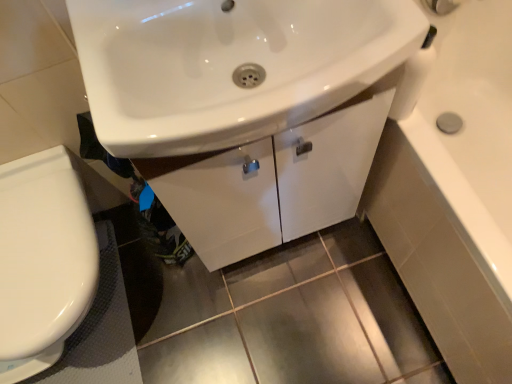
In order to click on white glossy toilet at lower left in this screenshot , I will do `click(42, 261)`.

What do you see at coordinates (101, 333) in the screenshot? I see `black rubber bath mat at lower left` at bounding box center [101, 333].

In order to face white glossy faucet at upper center, should I rotate leftwards or rightwards?

It's best to rotate left around 4.701 degrees.

Where is `white glossy faucet at upper center`? Image resolution: width=512 pixels, height=384 pixels. white glossy faucet at upper center is located at coordinates (261, 21).

Where is `white glossy cabinet at center`? The image size is (512, 384). white glossy cabinet at center is located at coordinates (274, 181).

Considering the sizes of objects white glossy toilet at lower left and white glossy sink at center in the image provided, who is thinner, white glossy toilet at lower left or white glossy sink at center?

white glossy sink at center.

Is white glossy toilet at lower left looking in the opposite direction of white glossy sink at center?

white glossy toilet at lower left is not turned away from white glossy sink at center.

Is white glossy toilet at lower left surrounding white glossy sink at center?

No, white glossy sink at center is not inside white glossy toilet at lower left.

Which is behind, point (58, 335) or point (133, 43)?

The point (58, 335) is more distant.

Looking at the image, does black rubber bath mat at lower left seem bigger or smaller compared to white glossy cabinet at center?

Clearly, black rubber bath mat at lower left is smaller in size than white glossy cabinet at center.

Where is `bath mat lying below the white glossy cabinet at center (from the image's perspective)`? bath mat lying below the white glossy cabinet at center (from the image's perspective) is located at coordinates (101, 333).

Can you tell me how much black rubber bath mat at lower left and white glossy cabinet at center differ in facing direction?

black rubber bath mat at lower left and white glossy cabinet at center are facing 88.2 degrees away from each other.

From the image's perspective, which one is positioned higher, black rubber bath mat at lower left or white glossy cabinet at center?

From the image's view, white glossy cabinet at center is above.

Are white glossy sink at center and white glossy toilet at lower left beside each other?

white glossy sink at center and white glossy toilet at lower left are not in contact.

Considering the points (312, 58) and (66, 278), which point is behind, point (312, 58) or point (66, 278)?

Positioned behind is point (66, 278).

Is white glossy sink at center bigger than white glossy toilet at lower left?

No.

In the scene shown: Which object is positioned more to the right, white glossy sink at center or white glossy toilet at lower left?

white glossy sink at center.

The width and height of the screenshot is (512, 384). In order to click on toilet located above the black rubber bath mat at lower left (from a real-world perspective) in this screenshot , I will do `click(42, 261)`.

How much distance is there between black rubber bath mat at lower left and white glossy toilet at lower left?

They are 30.96 centimeters apart.

Consider the image. Is black rubber bath mat at lower left positioned with its back to white glossy toilet at lower left?

No, black rubber bath mat at lower left is not facing the opposite direction of white glossy toilet at lower left.

Is the position of black rubber bath mat at lower left less distant than that of white glossy toilet at lower left?

No, black rubber bath mat at lower left is further to the viewer.

Is white glossy toilet at lower left oriented towards white glossy faucet at upper center?

No, white glossy toilet at lower left does not turn towards white glossy faucet at upper center.

Consider the image. Measure the distance from white glossy toilet at lower left to white glossy faucet at upper center.

white glossy toilet at lower left and white glossy faucet at upper center are 27.66 inches apart.

From a real-world perspective, is white glossy toilet at lower left over white glossy faucet at upper center?

Incorrect, from a real-world perspective, white glossy toilet at lower left is lower than white glossy faucet at upper center.

Looking at their sizes, would you say white glossy toilet at lower left is wider or thinner than white glossy faucet at upper center?

white glossy toilet at lower left is wider than white glossy faucet at upper center.

From a real-world perspective, relative to black rubber bath mat at lower left, is white glossy toilet at lower left vertically above or below?

white glossy toilet at lower left is above black rubber bath mat at lower left.

Can you confirm if white glossy toilet at lower left is taller than black rubber bath mat at lower left?

Yes.

Consider the image. Are white glossy toilet at lower left and black rubber bath mat at lower left making contact?

No, white glossy toilet at lower left is not next to black rubber bath mat at lower left.

From a real-world perspective, who is located higher, white glossy cabinet at center or white glossy sink at center?

white glossy sink at center.

How different are the orientations of white glossy cabinet at center and white glossy sink at center in degrees?

white glossy cabinet at center and white glossy sink at center are facing 0.255 degrees away from each other.

Is white glossy cabinet at center looking in the opposite direction of white glossy sink at center?

No, white glossy sink at center is not at the back of white glossy cabinet at center.

Identify the location of toilet that is behind the white glossy sink at center. (42, 261).

Where is `bathroom cabinet above the black rubber bath mat at lower left (from a real-world perspective)`? This screenshot has height=384, width=512. bathroom cabinet above the black rubber bath mat at lower left (from a real-world perspective) is located at coordinates (274, 181).

Estimate the real-world distances between objects in this image. Which object is closer to white glossy toilet at lower left, white glossy cabinet at center or black rubber bath mat at lower left?

The object closer to white glossy toilet at lower left is black rubber bath mat at lower left.

Considering their positions, is white glossy cabinet at center positioned closer to black rubber bath mat at lower left than white glossy faucet at upper center?

white glossy cabinet at center lies closer to black rubber bath mat at lower left than the other object.

Looking at the image, which one is located closer to white glossy faucet at upper center, black rubber bath mat at lower left or white glossy cabinet at center?

white glossy cabinet at center is positioned closer to the anchor white glossy faucet at upper center.

Estimate the real-world distances between objects in this image. Which object is further from white glossy cabinet at center, white glossy sink at center or white glossy faucet at upper center?

The object further to white glossy cabinet at center is white glossy faucet at upper center.

Looking at the image, which one is located closer to white glossy faucet at upper center, white glossy sink at center or white glossy cabinet at center?

white glossy sink at center lies closer to white glossy faucet at upper center than the other object.

From the picture: Looking at the image, which one is located closer to white glossy cabinet at center, white glossy faucet at upper center or black rubber bath mat at lower left?

white glossy faucet at upper center lies closer to white glossy cabinet at center than the other object.

Looking at the image, which one is located closer to white glossy cabinet at center, black rubber bath mat at lower left or white glossy sink at center?

Among the two, white glossy sink at center is located nearer to white glossy cabinet at center.

Considering their positions, is white glossy cabinet at center positioned closer to white glossy toilet at lower left than white glossy sink at center?

Based on the image, white glossy cabinet at center appears to be nearer to white glossy toilet at lower left.

The image size is (512, 384). In order to click on sink between white glossy toilet at lower left and white glossy cabinet at center in this screenshot , I will do `click(230, 66)`.

Where is `faucet between white glossy toilet at lower left and white glossy cabinet at center in the horizontal direction`? This screenshot has height=384, width=512. faucet between white glossy toilet at lower left and white glossy cabinet at center in the horizontal direction is located at coordinates (261, 21).

This screenshot has width=512, height=384. In order to click on sink between white glossy faucet at upper center and black rubber bath mat at lower left in the up-down direction in this screenshot , I will do `click(230, 66)`.

Find the location of a particular element. toilet between white glossy sink at center and black rubber bath mat at lower left from front to back is located at coordinates (42, 261).